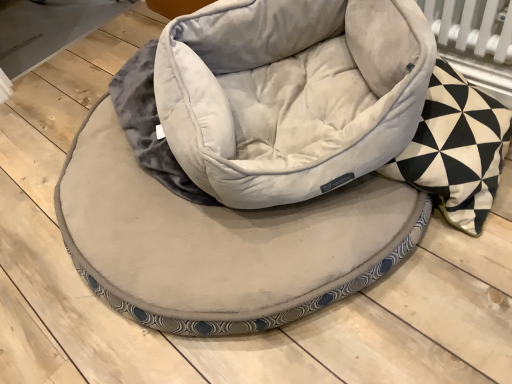
Question: Should I look upward or downward to see black and white geometric patterned pillow at right?

Choices:
 (A) down
 (B) up

Answer: (B)

Question: Is black and white geometric patterned pillow at right surrounded by velvet-like beige dog bed at center?

Choices:
 (A) no
 (B) yes

Answer: (A)

Question: Considering the relative sizes of velvet-like beige dog bed at center and black and white geometric patterned pillow at right in the image provided, is velvet-like beige dog bed at center wider than black and white geometric patterned pillow at right?

Choices:
 (A) no
 (B) yes

Answer: (B)

Question: Is velvet-like beige dog bed at center at the left side of black and white geometric patterned pillow at right?

Choices:
 (A) no
 (B) yes

Answer: (B)

Question: Would you say velvet-like beige dog bed at center is outside black and white geometric patterned pillow at right?

Choices:
 (A) yes
 (B) no

Answer: (A)

Question: Considering the relative sizes of velvet-like beige dog bed at center and black and white geometric patterned pillow at right in the image provided, is velvet-like beige dog bed at center thinner than black and white geometric patterned pillow at right?

Choices:
 (A) no
 (B) yes

Answer: (A)

Question: From the image's perspective, does velvet-like beige dog bed at center appear lower than black and white geometric patterned pillow at right?

Choices:
 (A) yes
 (B) no

Answer: (A)

Question: From a real-world perspective, is black and white geometric patterned pillow at right beneath velvet-like beige dog bed at center?

Choices:
 (A) no
 (B) yes

Answer: (A)

Question: Does black and white geometric patterned pillow at right have a larger size compared to velvet-like beige dog bed at center?

Choices:
 (A) no
 (B) yes

Answer: (A)

Question: Can velvet-like beige dog bed at center be found inside black and white geometric patterned pillow at right?

Choices:
 (A) yes
 (B) no

Answer: (B)

Question: Considering the relative positions of black and white geometric patterned pillow at right and velvet-like beige dog bed at center in the image provided, is black and white geometric patterned pillow at right to the left of velvet-like beige dog bed at center from the viewer's perspective?

Choices:
 (A) yes
 (B) no

Answer: (B)

Question: Is black and white geometric patterned pillow at right placed right next to velvet-like beige dog bed at center?

Choices:
 (A) no
 (B) yes

Answer: (A)

Question: Does black and white geometric patterned pillow at right have a greater width compared to velvet-like beige dog bed at center?

Choices:
 (A) no
 (B) yes

Answer: (A)

Question: From the image's perspective, is suede-like beige bean bag chair at center over black and white geometric patterned pillow at right?

Choices:
 (A) no
 (B) yes

Answer: (B)